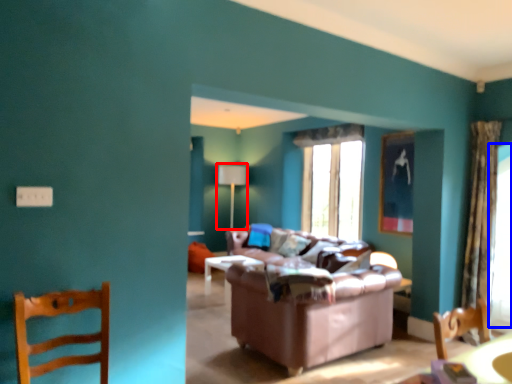
Question: Among these objects, which one is nearest to the camera, lamp (highlighted by a red box) or window screen (highlighted by a blue box)?

Choices:
 (A) lamp
 (B) window screen

Answer: (B)